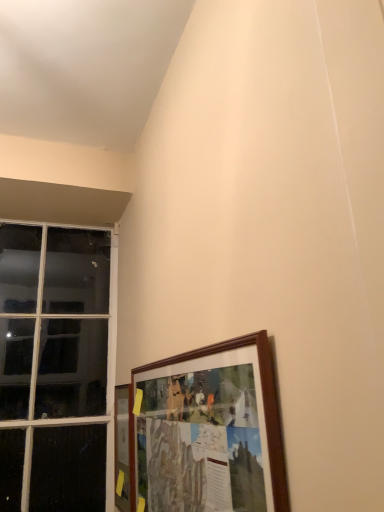
Question: Considering the relative sizes of clear glass window at left and wooden frame at lower right, positioned as the 1th picture frame in front-to-back order, in the image provided, is clear glass window at left bigger than wooden frame at lower right, positioned as the 1th picture frame in front-to-back order,?

Choices:
 (A) no
 (B) yes

Answer: (B)

Question: From the image's perspective, is clear glass window at left below wooden frame at lower right, which is counted as the 2th picture frame, starting from the back?

Choices:
 (A) yes
 (B) no

Answer: (B)

Question: Does clear glass window at left appear on the right side of wooden frame at lower right, which is counted as the 2th picture frame, starting from the back?

Choices:
 (A) yes
 (B) no

Answer: (B)

Question: Is clear glass window at left oriented away from wooden frame at lower right, positioned as the 1th picture frame in front-to-back order?

Choices:
 (A) yes
 (B) no

Answer: (B)

Question: Is clear glass window at left shorter than wooden frame at lower right, the 1th picture frame viewed from the right?

Choices:
 (A) yes
 (B) no

Answer: (B)

Question: Are clear glass window at left and wooden frame at lower right, the 1th picture frame viewed from the right, far apart?

Choices:
 (A) no
 (B) yes

Answer: (B)

Question: Does wooden frame at lower right, the 1th picture frame viewed from the right, have a greater width compared to wooden picture frame at lower left, which is counted as the second picture frame, starting from the right?

Choices:
 (A) yes
 (B) no

Answer: (A)

Question: Does wooden frame at lower right, the 1th picture frame viewed from the right, have a lesser width compared to wooden picture frame at lower left, which is the first picture frame in back-to-front order?

Choices:
 (A) no
 (B) yes

Answer: (A)

Question: Is wooden frame at lower right, marked as the 2th picture frame in a left-to-right arrangement, directly adjacent to wooden picture frame at lower left, which is the first picture frame in back-to-front order?

Choices:
 (A) no
 (B) yes

Answer: (A)

Question: Is wooden frame at lower right, marked as the 2th picture frame in a left-to-right arrangement, at the right side of wooden picture frame at lower left, which is counted as the second picture frame, starting from the right?

Choices:
 (A) yes
 (B) no

Answer: (A)

Question: Can you confirm if wooden frame at lower right, the 1th picture frame viewed from the right, is positioned to the left of wooden picture frame at lower left, which is the second picture frame from front to back?

Choices:
 (A) no
 (B) yes

Answer: (A)

Question: Is wooden frame at lower right, the 1th picture frame viewed from the right, further to the viewer compared to wooden picture frame at lower left, which is the first picture frame in back-to-front order?

Choices:
 (A) yes
 (B) no

Answer: (B)

Question: Considering the relative positions of clear glass window at left and wooden picture frame at lower left, which is the second picture frame from front to back, in the image provided, is clear glass window at left to the right of wooden picture frame at lower left, which is the second picture frame from front to back, from the viewer's perspective?

Choices:
 (A) yes
 (B) no

Answer: (B)